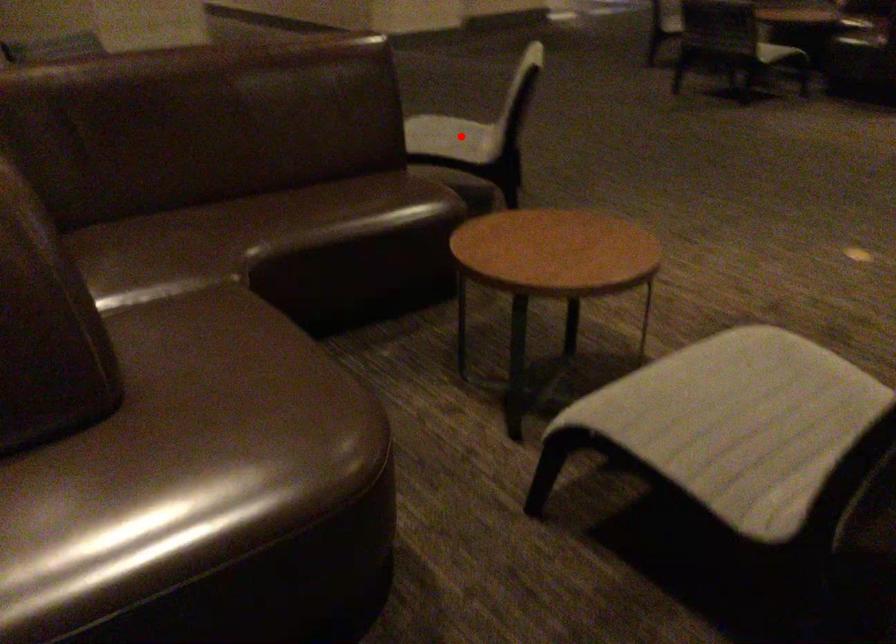
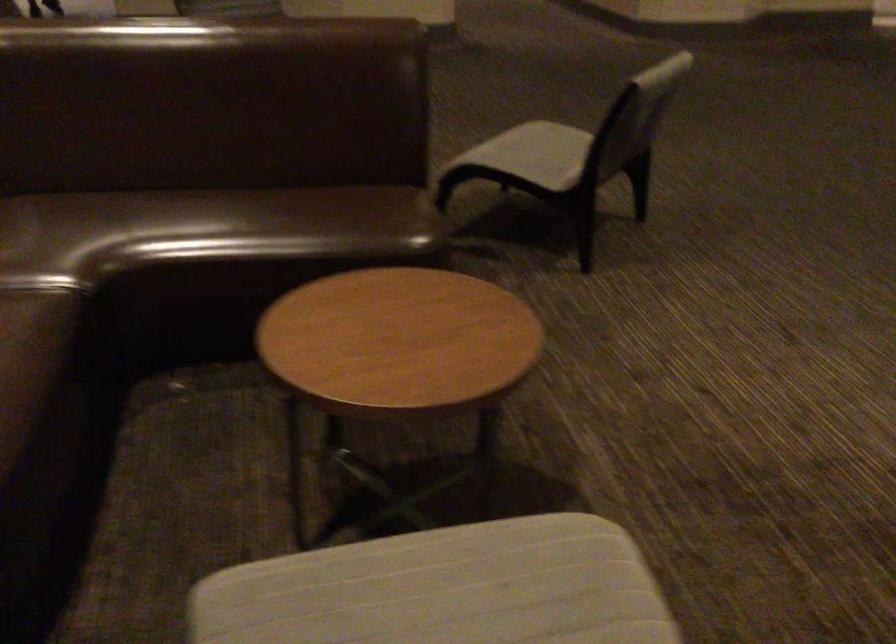
Question: I am providing you with two images of the same scene from different viewpoints. In image1, a red point is highlighted. Considering the same 3D point in image2, which of the following is correct?

Choices:
 (A) It is closer
 (B) It is farther

Answer: (A)